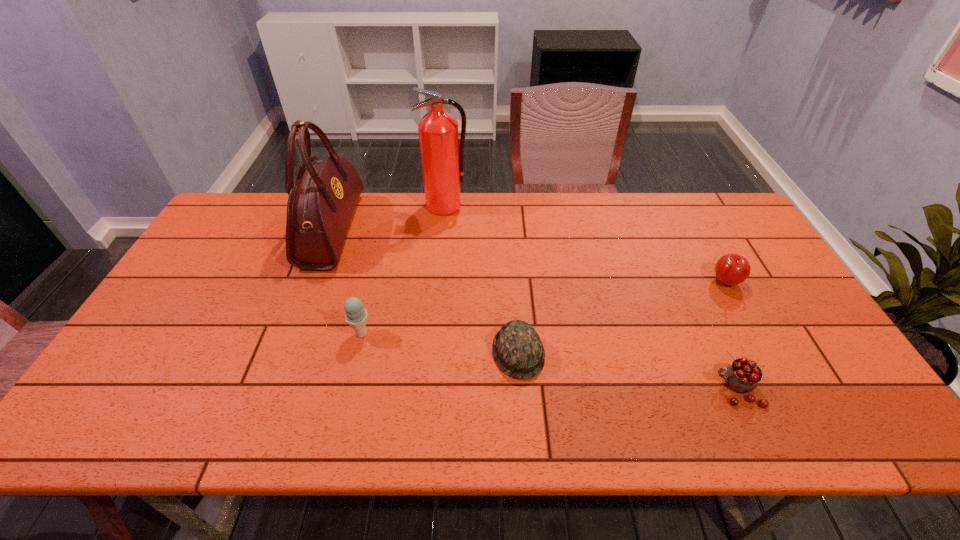
Find the location of a particular element. This screenshot has height=540, width=960. vacant region located on the front-facing side of the handbag is located at coordinates (455, 230).

Locate an element on the screen. Image resolution: width=960 pixels, height=540 pixels. free location located 0.360m on the right of the ice cream is located at coordinates (511, 334).

This screenshot has width=960, height=540. Identify the location of free space located 0.340m on the back of the rightmost object. (684, 204).

Locate an element on the screen. vacant space located on the handle side of the fifth object from left to right is located at coordinates (558, 389).

This screenshot has width=960, height=540. Identify the location of vacant space located 0.340m on the handle side of the fifth object from left to right. pos(570,389).

Locate an element on the screen. Image resolution: width=960 pixels, height=540 pixels. vacant space located 0.180m on the handle side of the fifth object from left to right is located at coordinates (638, 389).

Find the location of a particular element. Image resolution: width=960 pixels, height=540 pixels. free space located on the right of the headwear is located at coordinates (696, 353).

This screenshot has width=960, height=540. Find the location of `fire extinguisher at the far edge`. fire extinguisher at the far edge is located at coordinates (442, 160).

You are a GUI agent. You are given a task and a screenshot of the screen. Output one action in this format:
    pyautogui.click(x=<x>, y=<y>)
    Task: Click on the handbag located at the far edge
    This screenshot has height=540, width=960.
    Given the screenshot: What is the action you would take?
    pyautogui.click(x=322, y=198)

Identify the location of object at the near edge. Image resolution: width=960 pixels, height=540 pixels. (743, 375).